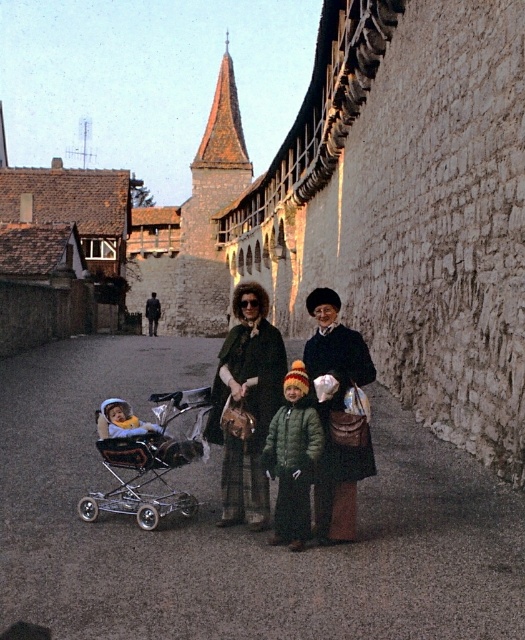
Which is behind, point (224, 340) or point (296, 509)?

Point (224, 340)

Is point (232, 502) in front of point (267, 448)?

No, it is behind (267, 448).

This screenshot has height=640, width=525. Identify the location of green woolen coat at center. (246, 403).

Between velvet black coat at center and green fuzzy coat at center, which one appears on the left side from the viewer's perspective?

green fuzzy coat at center is more to the left.

Is the position of velvet black coat at center more distant than that of green fuzzy coat at center?

That is True.

Who is more distant from viewer, (340, 410) or (297, 506)?

Point (340, 410)

Locate an element on the screen. velvet black coat at center is located at coordinates (338, 417).

Does point (161, 360) lie in front of point (107, 404)?

No, (161, 360) is further to viewer.

Can you confirm if dark gray asphalt at center is bigger than soft yellow fabric baby carriage at lower left?

Correct, dark gray asphalt at center is larger in size than soft yellow fabric baby carriage at lower left.

At what (x,y) coordinates should I click in order to perform the action: click on dark gray asphalt at center. Please return your answer as a coordinate pair (x, y). This screenshot has height=640, width=525. Looking at the image, I should click on (237, 525).

In order to click on dark gray asphalt at center in this screenshot , I will do `click(237, 525)`.